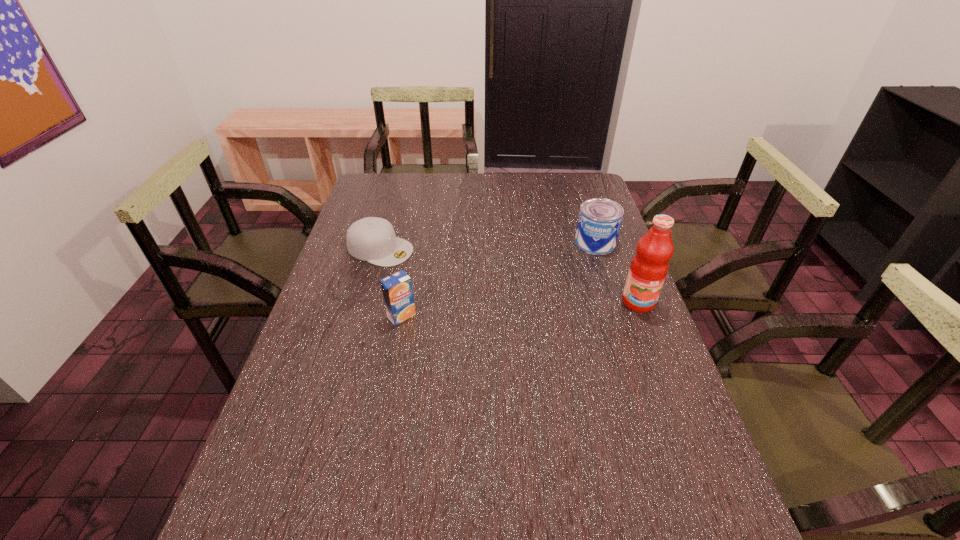
Find the location of a particular element. This screenshot has width=960, height=540. orange_juice is located at coordinates (397, 290).

Locate an element on the screen. This screenshot has width=960, height=540. fruit juice is located at coordinates (649, 266).

The height and width of the screenshot is (540, 960). What are the coordinates of `cap` in the screenshot? It's located at (372, 239).

In order to click on can in this screenshot , I will do `click(599, 222)`.

You are a GUI agent. You are given a task and a screenshot of the screen. Output one action in this format:
    pyautogui.click(x=<x>, y=<y>)
    Task: Click on the vacant region located 0.360m on the front of the orange_juice
    The image size is (960, 540).
    Given the screenshot: What is the action you would take?
    pyautogui.click(x=376, y=453)

The image size is (960, 540). I want to click on free spot located 0.110m on the front label of the fruit juice, so [x=655, y=345].

The width and height of the screenshot is (960, 540). In order to click on free spot located 0.260m on the front-facing side of the cap in this screenshot , I will do `click(481, 281)`.

Identify the location of vacant region located on the front-facing side of the cap. This screenshot has height=540, width=960. (496, 286).

Locate an element on the screen. This screenshot has width=960, height=540. vacant area located 0.120m on the front-facing side of the cap is located at coordinates (441, 267).

Identify the location of blank space located on the front label of the can. The width and height of the screenshot is (960, 540). (578, 262).